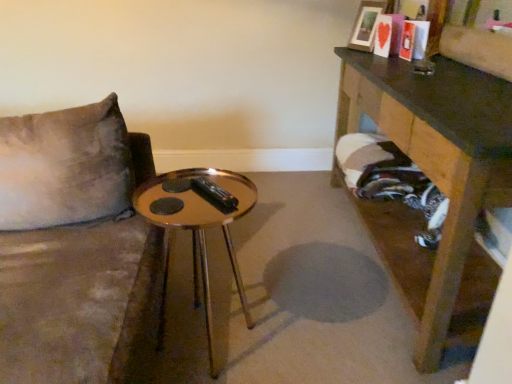
Question: Could you tell me if gold reflective table at center, placed as the first table when sorted from left to right, is facing wooden picture frame at upper right?

Choices:
 (A) no
 (B) yes

Answer: (A)

Question: Does gold reflective table at center, which appears as the 2th table when viewed from the right, touch wooden picture frame at upper right?

Choices:
 (A) yes
 (B) no

Answer: (B)

Question: Is gold reflective table at center, which appears as the 2th table when viewed from the right, taller than wooden picture frame at upper right?

Choices:
 (A) yes
 (B) no

Answer: (A)

Question: Could wooden picture frame at upper right be considered to be inside gold reflective table at center, placed as the first table when sorted from left to right?

Choices:
 (A) yes
 (B) no

Answer: (B)

Question: Is gold reflective table at center, placed as the first table when sorted from left to right, wider than wooden picture frame at upper right?

Choices:
 (A) no
 (B) yes

Answer: (B)

Question: In terms of size, does wooden table at right, the 2th table from the left, appear bigger or smaller than gold reflective table at center, which appears as the 2th table when viewed from the right?

Choices:
 (A) small
 (B) big

Answer: (B)

Question: From the image's perspective, is wooden table at right, which is the 1th table from right to left, positioned above or below gold reflective table at center, which appears as the 2th table when viewed from the right?

Choices:
 (A) above
 (B) below

Answer: (A)

Question: Is wooden table at right, the 2th table from the left, to the left or to the right of gold reflective table at center, placed as the first table when sorted from left to right, in the image?

Choices:
 (A) right
 (B) left

Answer: (A)

Question: Which is correct: wooden table at right, the 2th table from the left, is inside gold reflective table at center, placed as the first table when sorted from left to right, or outside of it?

Choices:
 (A) inside
 (B) outside

Answer: (B)

Question: Would you say gold reflective table at center, placed as the first table when sorted from left to right, is inside or outside wooden picture frame at upper right?

Choices:
 (A) inside
 (B) outside

Answer: (B)

Question: From the image's perspective, is gold reflective table at center, which appears as the 2th table when viewed from the right, above or below wooden picture frame at upper right?

Choices:
 (A) above
 (B) below

Answer: (B)

Question: Is gold reflective table at center, placed as the first table when sorted from left to right, bigger or smaller than wooden picture frame at upper right?

Choices:
 (A) small
 (B) big

Answer: (B)

Question: Is gold reflective table at center, placed as the first table when sorted from left to right, in front of or behind wooden picture frame at upper right in the image?

Choices:
 (A) front
 (B) behind

Answer: (A)

Question: Is wooden table at right, which is the 1th table from right to left, inside the boundaries of wooden picture frame at upper right, or outside?

Choices:
 (A) inside
 (B) outside

Answer: (B)

Question: Relative to wooden picture frame at upper right, is wooden table at right, which is the 1th table from right to left, in front or behind?

Choices:
 (A) front
 (B) behind

Answer: (A)